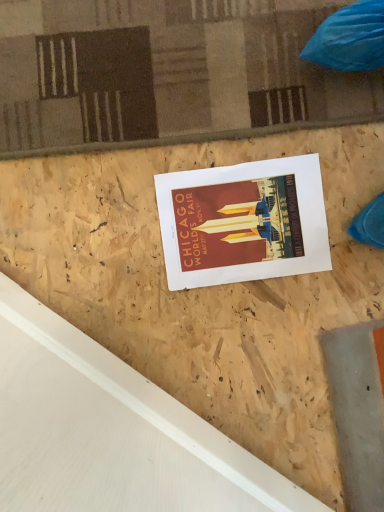
Where is `vacant space situated above matte paper poster at center (from a real-world perspective)`? This screenshot has width=384, height=512. vacant space situated above matte paper poster at center (from a real-world perspective) is located at coordinates (239, 222).